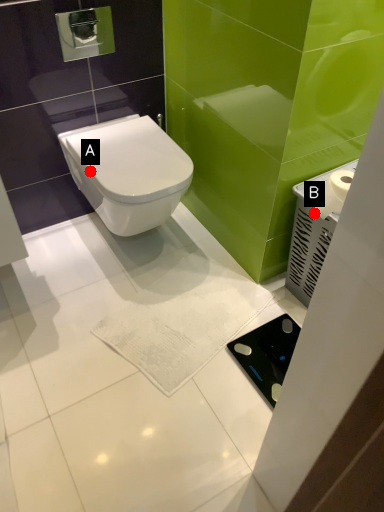
Question: Two points are circled on the image, labeled by A and B beside each circle. Which point is farther to the camera?

Choices:
 (A) A is further
 (B) B is further

Answer: (A)